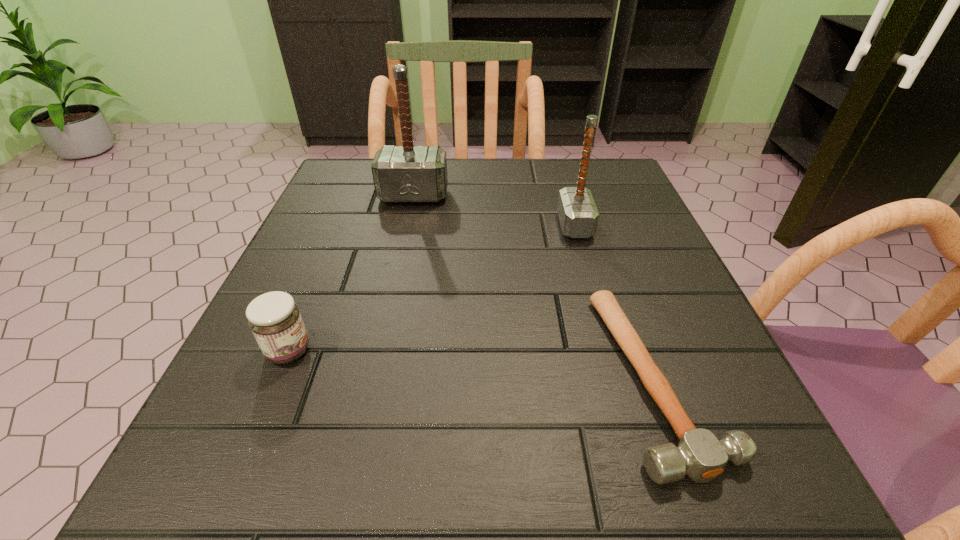
What are the coordinates of `free spot that satisfies the following two spatial constraints: 1. on the front side of the nearest hammer; 2. on the right side of the farthest object` in the screenshot? It's located at (373, 377).

You are a GUI agent. You are given a task and a screenshot of the screen. Output one action in this format:
    pyautogui.click(x=<x>, y=<y>)
    Task: Click on the free space that satisfies the following two spatial constraints: 1. on the striking surface of the second tallest hammer; 2. on the back side of the shortest object
    
    Given the screenshot: What is the action you would take?
    pyautogui.click(x=618, y=377)

Where is `vacant space that satisfies the following two spatial constraints: 1. on the back side of the shortest object; 2. on the front label of the second shortest object`? The image size is (960, 540). vacant space that satisfies the following two spatial constraints: 1. on the back side of the shortest object; 2. on the front label of the second shortest object is located at coordinates (649, 351).

The height and width of the screenshot is (540, 960). Find the location of `vacant region that satisfies the following two spatial constraints: 1. on the back side of the shortest object; 2. on the striking surface of the second farthest hammer`. vacant region that satisfies the following two spatial constraints: 1. on the back side of the shortest object; 2. on the striking surface of the second farthest hammer is located at coordinates (603, 226).

You are a GUI agent. You are given a task and a screenshot of the screen. Output one action in this format:
    pyautogui.click(x=<x>, y=<y>)
    Task: Click on the free space in the image that satisfies the following two spatial constraints: 1. on the front label of the shortest hammer; 2. on the right side of the jam
    The image size is (960, 540).
    Given the screenshot: What is the action you would take?
    pyautogui.click(x=277, y=377)